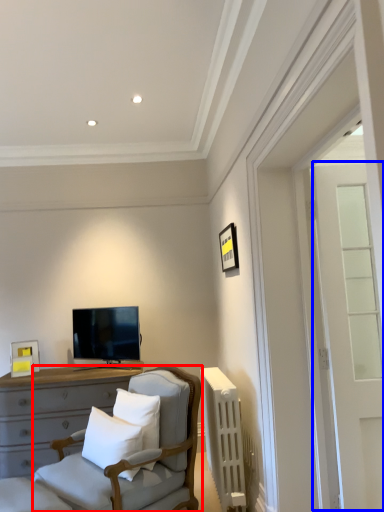
Question: Among these objects, which one is farthest to the camera, chair (highlighted by a red box) or glass door (highlighted by a blue box)?

Choices:
 (A) chair
 (B) glass door

Answer: (B)